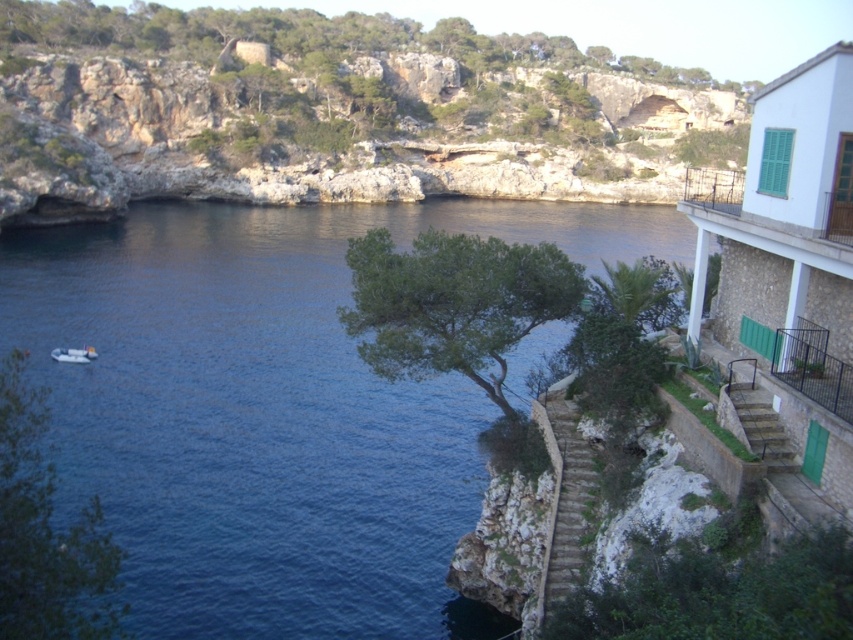
Question: Does green leafy tree at lower right appear under green leafy palm at center?

Choices:
 (A) yes
 (B) no

Answer: (A)

Question: Which of the following is the closest to the observer?

Choices:
 (A) (654, 550)
 (B) (624, 307)
 (C) (300, 589)
 (D) (402, 296)

Answer: (A)

Question: Is blue water at center wider than green leafy tree at lower right?

Choices:
 (A) yes
 (B) no

Answer: (A)

Question: Considering the real-world distances, which object is farthest from the blue water at center?

Choices:
 (A) green leafy tree at lower right
 (B) green leafy tree at center
 (C) green leafy tree at left
 (D) white plastic boat at lower left

Answer: (A)

Question: Which point is farther to the camera?

Choices:
 (A) (448, 253)
 (B) (84, 388)
 (C) (619, 294)
 (D) (39, 627)

Answer: (B)

Question: Does green leafy tree at center appear on the left side of white plastic boat at lower left?

Choices:
 (A) yes
 (B) no

Answer: (B)